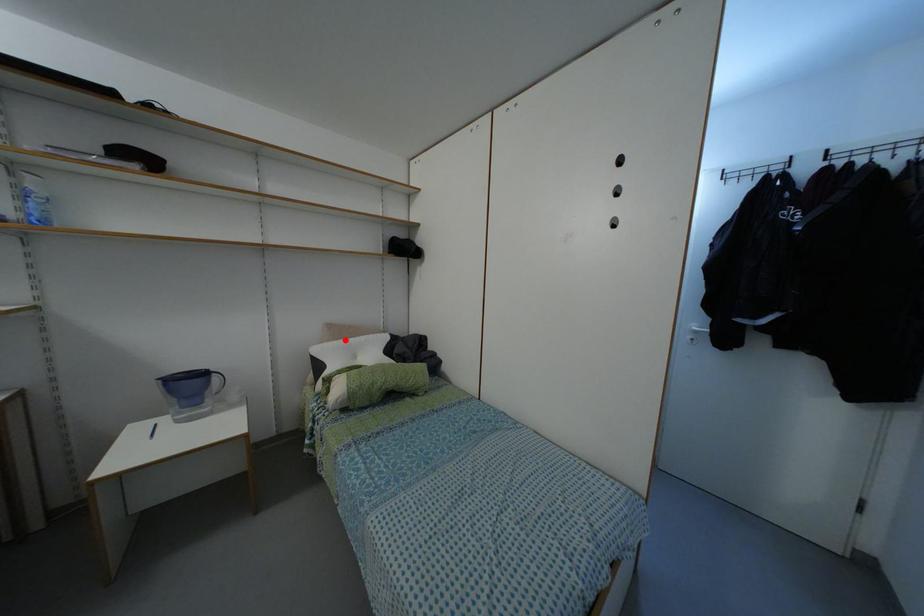
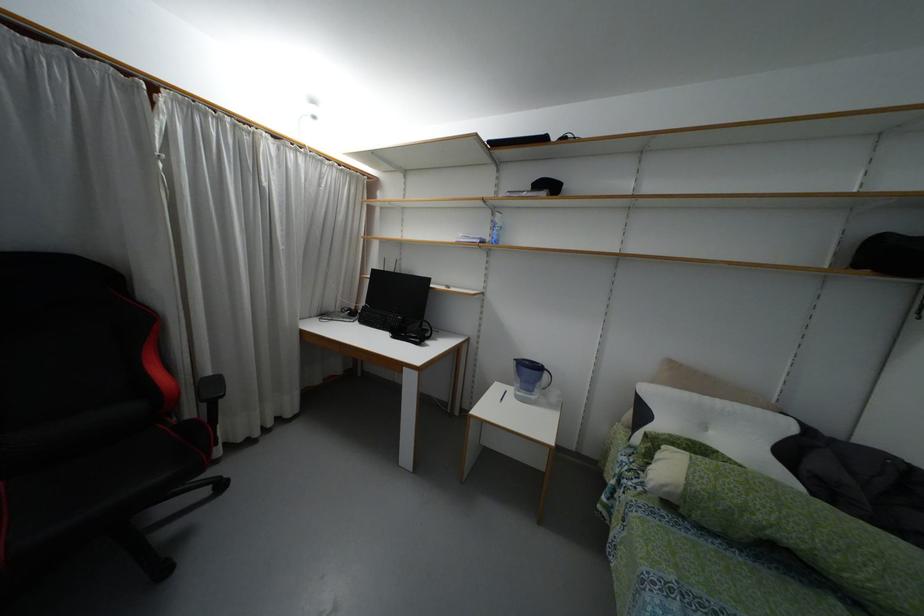
Where in the second image is the point corresponding to the highlighted location from the first image?

(695, 395)